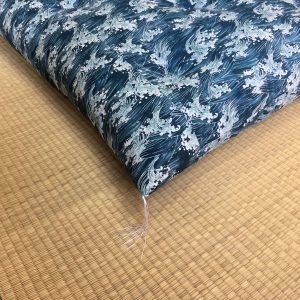
Image resolution: width=300 pixels, height=300 pixels. Find the location of `lines on wicker mat`. lines on wicker mat is located at coordinates (253, 217), (68, 168), (72, 178).